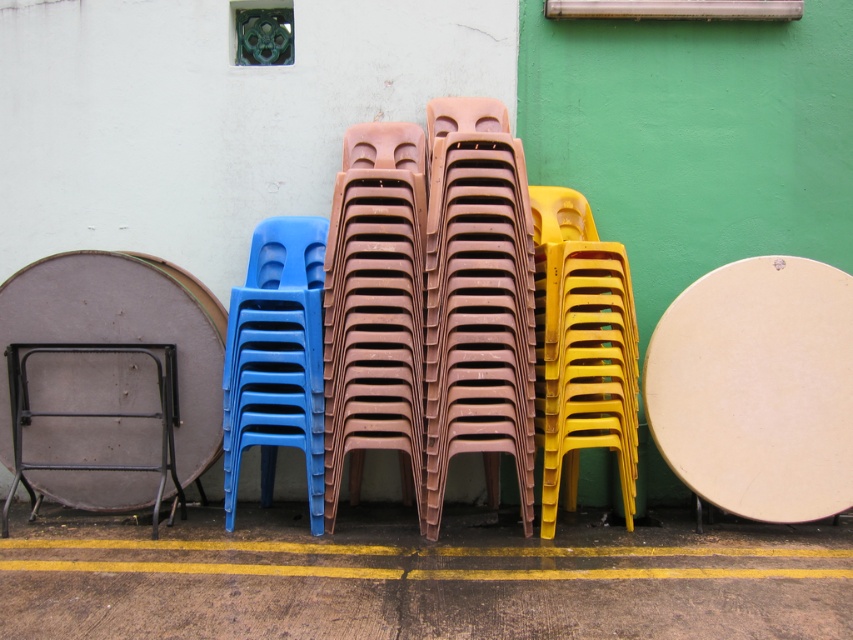
Which is in front, point (503, 202) or point (407, 371)?

Point (407, 371) is in front.

Does point (531, 307) lie behind point (407, 292)?

No, it is in front of (407, 292).

You are a GUI agent. You are given a task and a screenshot of the screen. Output one action in this format:
    pyautogui.click(x=<x>, y=<y>)
    Task: Click on the matte plastic chairs at center
    The width and height of the screenshot is (853, 640).
    Given the screenshot: What is the action you would take?
    pyautogui.click(x=479, y=310)

Locate an element on the screen. The height and width of the screenshot is (640, 853). matte plastic chairs at center is located at coordinates (479, 310).

Who is shorter, matte plastic chairs at center or black metal folding table at lower left?

black metal folding table at lower left is shorter.

Is matte plastic chairs at center above black metal folding table at lower left?

Yes, matte plastic chairs at center is above black metal folding table at lower left.

Is point (518, 324) positioned before point (15, 372)?

Yes, it is.

Where is `matte plastic chairs at center`? matte plastic chairs at center is located at coordinates (479, 310).

Which is behind, point (380, 388) or point (68, 467)?

Positioned behind is point (68, 467).

Is brown plastic chairs at center to the left of black metal folding table at lower left from the viewer's perspective?

Incorrect, brown plastic chairs at center is not on the left side of black metal folding table at lower left.

Is point (398, 214) positioned behind point (96, 342)?

No, it is not.

The width and height of the screenshot is (853, 640). I want to click on brown plastic chairs at center, so click(x=375, y=308).